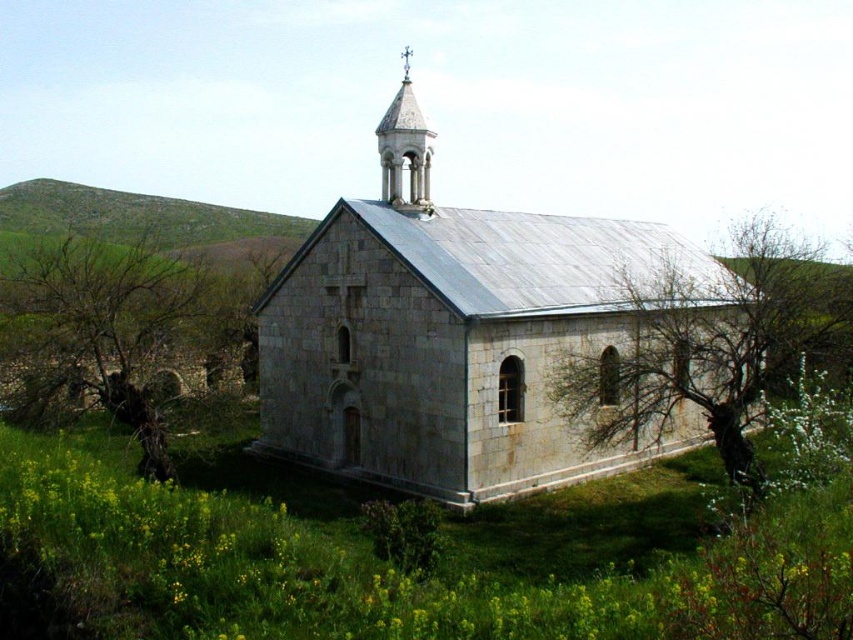
Question: Among these objects, which one is farthest from the camera?

Choices:
 (A) bare branches at right
 (B) brown rough tree at lower left
 (C) white stone spire at upper center

Answer: (C)

Question: Does gray stone church at center appear on the right side of white stone spire at upper center?

Choices:
 (A) yes
 (B) no

Answer: (A)

Question: Which object is positioned closest to the bare branches at right?

Choices:
 (A) white stone spire at upper center
 (B) brown rough tree at lower left

Answer: (A)

Question: Can you confirm if gray stone church at center is bigger than bare branches at right?

Choices:
 (A) no
 (B) yes

Answer: (A)

Question: Which object is the closest to the gray stone church at center?

Choices:
 (A) bare branches at right
 (B) brown rough tree at lower left
 (C) white stone spire at upper center

Answer: (A)

Question: From the image, what is the correct spatial relationship of brown rough tree at lower left in relation to white stone spire at upper center?

Choices:
 (A) below
 (B) above

Answer: (A)